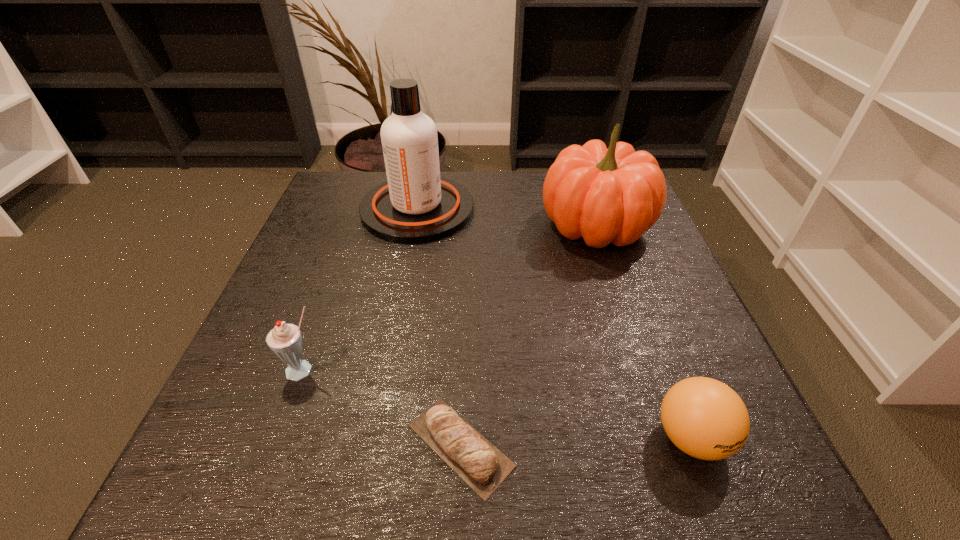
The image size is (960, 540). Identify the location of cleansing agent that is at the far edge. (415, 205).

The width and height of the screenshot is (960, 540). Find the location of `pumpkin that is positioned at the far edge`. pumpkin that is positioned at the far edge is located at coordinates (615, 195).

Find the location of `ping-pong ball positioned at the near edge`. ping-pong ball positioned at the near edge is located at coordinates (706, 419).

The width and height of the screenshot is (960, 540). In order to click on pita bread at the near edge in this screenshot , I will do point(471,455).

You are a GUI agent. You are given a task and a screenshot of the screen. Output one action in this format:
    pyautogui.click(x=<x>, y=<y>)
    Task: Click on the cleansing agent that is at the left edge
    The image size is (960, 540).
    Given the screenshot: What is the action you would take?
    pyautogui.click(x=415, y=205)

Find the location of `milkshake that is at the left edge`. milkshake that is at the left edge is located at coordinates (285, 340).

Find the location of a particular element. The image size is (960, 540). pumpkin that is at the right edge is located at coordinates (615, 195).

Find the location of a particular element. This screenshot has height=540, width=960. ping-pong ball at the right edge is located at coordinates (706, 419).

Locate an element on the screen. This screenshot has width=960, height=540. object positioned at the far left corner is located at coordinates (415, 205).

Find the location of `object present at the far right corner`. object present at the far right corner is located at coordinates (615, 195).